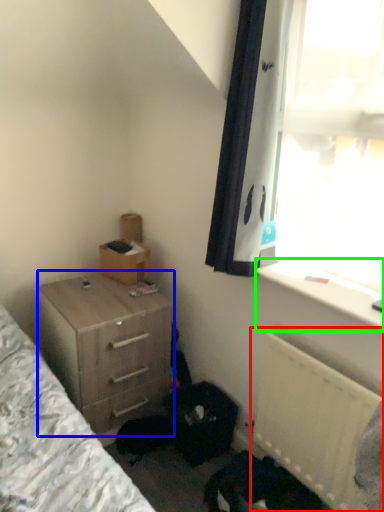
Question: Based on their relative distances, which object is nearer to radiator (highlighted by a red box)? Choose from chest of drawers (highlighted by a blue box) and window sill (highlighted by a green box).

Choices:
 (A) chest of drawers
 (B) window sill

Answer: (B)